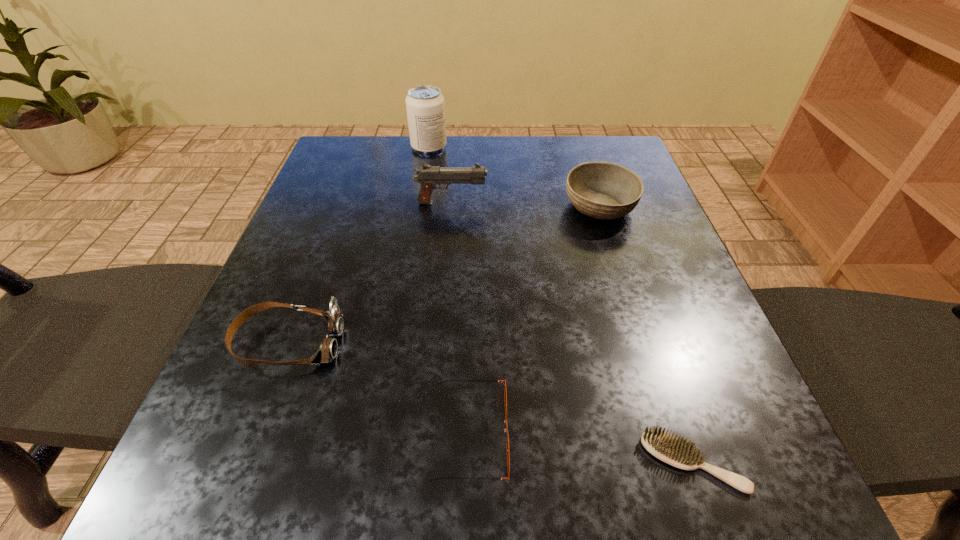
You are a GUI agent. You are given a task and a screenshot of the screen. Output one action in this format:
    pyautogui.click(x=<x>, y=<y>)
    Task: Click on the free space located 0.260m on the left of the fourth shortest object
    The height and width of the screenshot is (540, 960).
    Given the screenshot: What is the action you would take?
    pyautogui.click(x=444, y=207)

I want to click on vacant point located 0.180m on the front-facing side of the goggles, so click(454, 343).

At what (x,y) coordinates should I click in order to perform the action: click on free space located 0.320m on the face of the sunglasses. Please return your answer as a coordinate pair (x, y). Looking at the image, I should click on (744, 433).

Locate an element on the screen. The image size is (960, 540). vacant space located 0.120m on the left of the shortest object is located at coordinates (551, 462).

Where is `soda can at the far edge`? soda can at the far edge is located at coordinates (425, 106).

The height and width of the screenshot is (540, 960). Identify the location of bowl present at the far edge. (603, 190).

Where is `sunglasses that is at the near edge`? sunglasses that is at the near edge is located at coordinates (502, 381).

Where is `scrubbing brush present at the near edge`? The width and height of the screenshot is (960, 540). scrubbing brush present at the near edge is located at coordinates (675, 451).

Identify the location of object at the left edge. (327, 351).

The height and width of the screenshot is (540, 960). I want to click on bowl present at the right edge, so click(x=603, y=190).